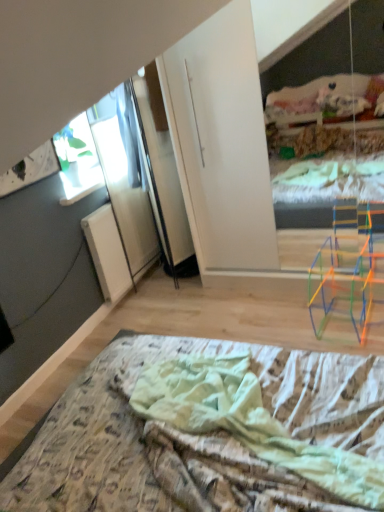
Question: Do you think transparent glass window at upper left is within printed fabric bed at lower center, or outside of it?

Choices:
 (A) outside
 (B) inside

Answer: (A)

Question: From the image's perspective, relative to printed fabric bed at lower center, is transparent glass window at upper left above or below?

Choices:
 (A) above
 (B) below

Answer: (A)

Question: Relative to printed fabric bed at lower center, is transparent glass window at upper left in front or behind?

Choices:
 (A) behind
 (B) front

Answer: (A)

Question: Which is correct: printed fabric bed at lower center is inside transparent glass window at upper left, or outside of it?

Choices:
 (A) outside
 (B) inside

Answer: (A)

Question: Is printed fabric bed at lower center to the left or to the right of transparent glass window at upper left in the image?

Choices:
 (A) right
 (B) left

Answer: (A)

Question: From the image's perspective, is printed fabric bed at lower center above or below transparent glass window at upper left?

Choices:
 (A) below
 (B) above

Answer: (A)

Question: Considering the positions of printed fabric bed at lower center and transparent glass window at upper left in the image, is printed fabric bed at lower center wider or thinner than transparent glass window at upper left?

Choices:
 (A) thin
 (B) wide

Answer: (B)